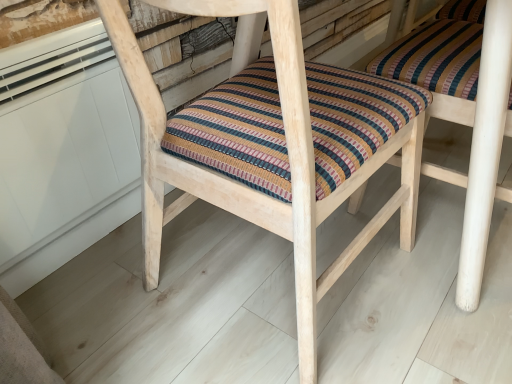
Where is `natural wood chair at center`? This screenshot has width=512, height=384. natural wood chair at center is located at coordinates (274, 145).

Describe the element at coordinates (274, 145) in the screenshot. I see `natural wood chair at center` at that location.

This screenshot has width=512, height=384. In order to click on natural wood chair at center in this screenshot , I will do `click(274, 145)`.